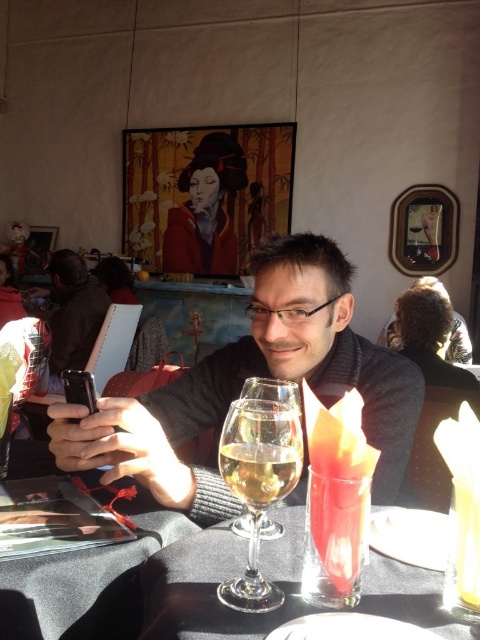
Question: Is black fabric table at lower left below matte black phone at left?

Choices:
 (A) yes
 (B) no

Answer: (A)

Question: Which object is farther from the camera taking this photo?

Choices:
 (A) translucent glass wine at center
 (B) clear glass at center
 (C) clear glass wine glass at center

Answer: (A)

Question: Among these objects, which one is nearest to the camera?

Choices:
 (A) clear glass wine glass at center
 (B) clear glass at center

Answer: (B)

Question: Which object appears farthest from the camera in this image?

Choices:
 (A) translucent glass wine at center
 (B) clear glass at center
 (C) black fabric table at lower left
 (D) knitted sweater at center

Answer: (D)

Question: Can you confirm if clear glass at center is positioned below translucent glass wine at center?

Choices:
 (A) no
 (B) yes

Answer: (B)

Question: Is knitted sweater at center above translucent glass wine at center?

Choices:
 (A) no
 (B) yes

Answer: (B)